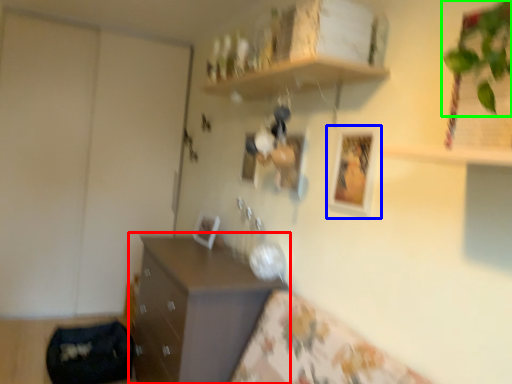
Question: Which object is the farthest from chest of drawers (highlighted by a red box)? Choose among these: picture frame (highlighted by a blue box) or plant (highlighted by a green box).

Choices:
 (A) picture frame
 (B) plant

Answer: (B)